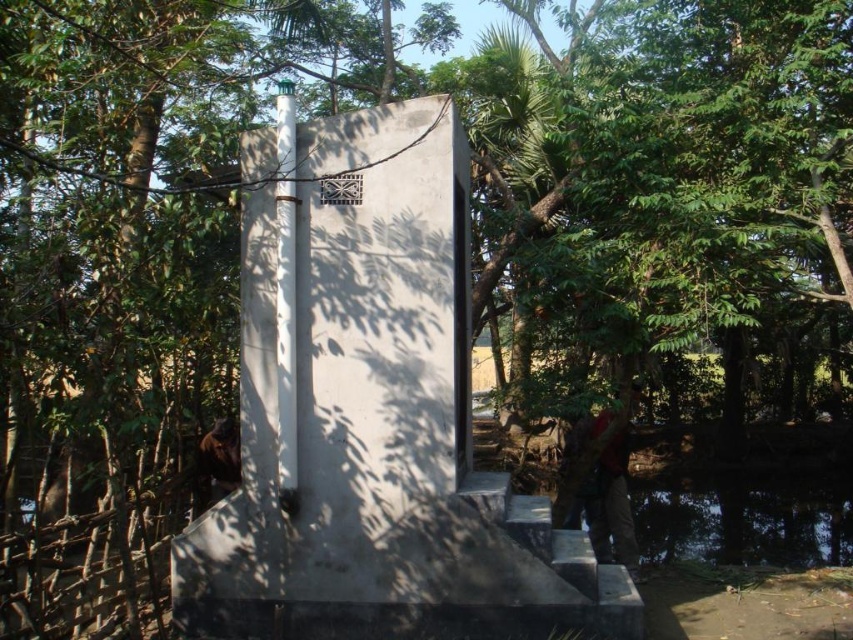
Question: Which of the following is the closest to the observer?

Choices:
 (A) red fabric jacket at lower right
 (B) brown fur at lower left
 (C) transparent glass pond at lower right

Answer: (B)

Question: Based on their relative distances, which object is farther from the transparent glass pond at lower right?

Choices:
 (A) red fabric jacket at lower right
 (B) brown fur at lower left

Answer: (B)

Question: Can you confirm if transparent glass pond at lower right is wider than brown fur at lower left?

Choices:
 (A) no
 (B) yes

Answer: (B)

Question: Which object appears closest to the camera in this image?

Choices:
 (A) red fabric jacket at lower right
 (B) brown fur at lower left

Answer: (B)

Question: Can you confirm if transparent glass pond at lower right is bigger than red fabric jacket at lower right?

Choices:
 (A) yes
 (B) no

Answer: (B)

Question: Is transparent glass pond at lower right bigger than red fabric jacket at lower right?

Choices:
 (A) no
 (B) yes

Answer: (A)